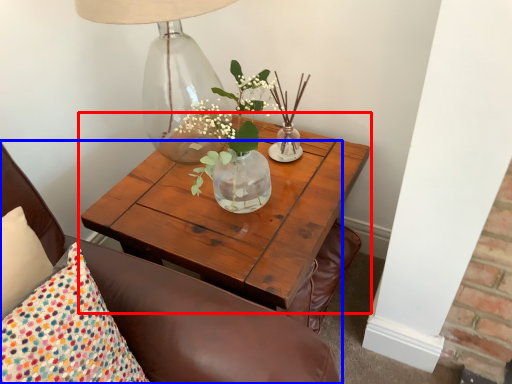
Question: Which of the following is the farthest to the observer, coffee table (highlighted by a red box) or chair (highlighted by a blue box)?

Choices:
 (A) coffee table
 (B) chair

Answer: (A)